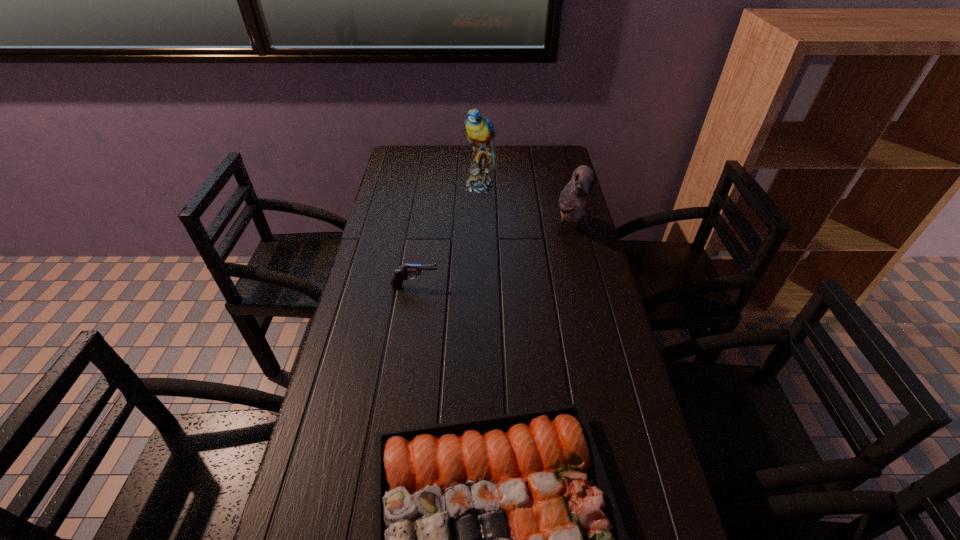
I want to click on object that is the third closest one to the shortest object, so click(480, 132).

Find the location of a particular element. This screenshot has height=540, width=960. object that stands as the second closest to the right parrot is located at coordinates (401, 274).

Locate an element on the screen. free space that satisfies the following two spatial constraints: 1. on the front-facing side of the second farthest object; 2. at the barrel of the second shortest object is located at coordinates (583, 286).

The height and width of the screenshot is (540, 960). What are the coordinates of `vacant area that satisfies the following two spatial constraints: 1. on the front-facing side of the shorter parrot; 2. at the barrel of the third tallest object` in the screenshot? It's located at pyautogui.click(x=583, y=286).

At what (x,y) coordinates should I click in order to perform the action: click on free region that satisfies the following two spatial constraints: 1. on the face of the left parrot; 2. at the barrel of the third tallest object. Please return your answer as a coordinate pair (x, y). The image size is (960, 540). Looking at the image, I should click on [x=479, y=286].